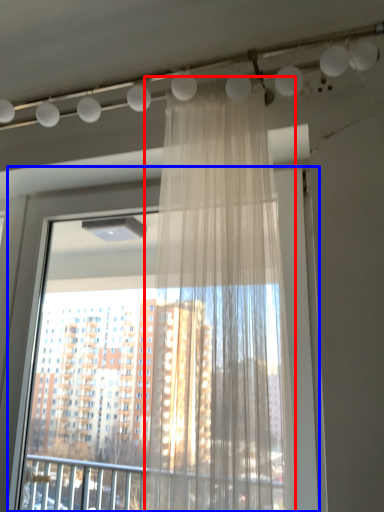
Question: Which object appears closest to the camera in this image, curtain (highlighted by a red box) or window (highlighted by a blue box)?

Choices:
 (A) curtain
 (B) window

Answer: (A)